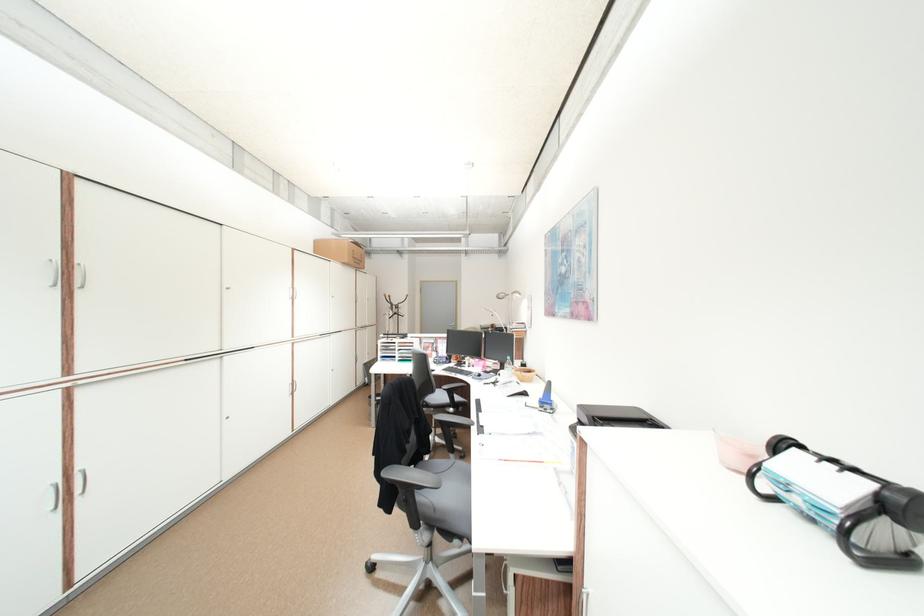
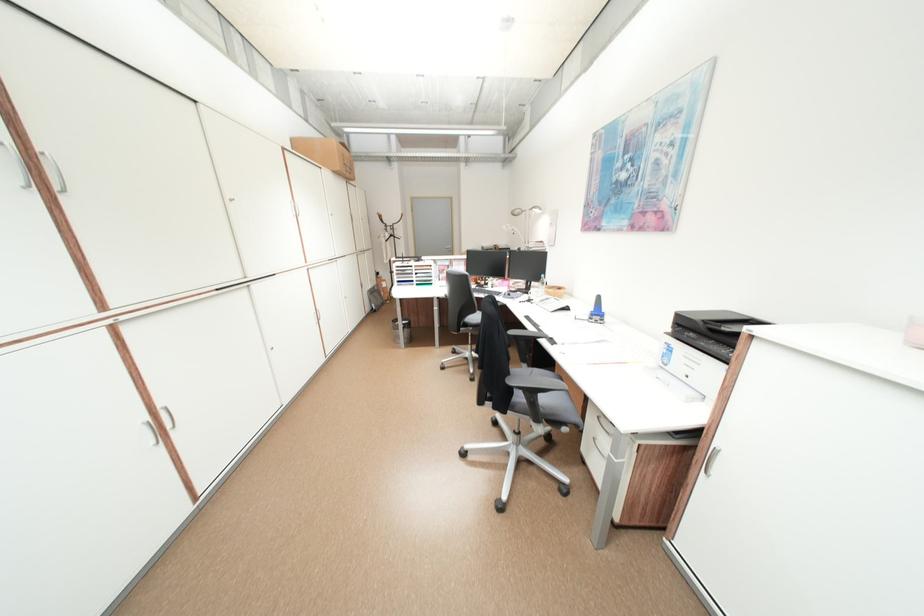
Question: Based on the continuous images, in which direction is the camera rotating? Reply with the corresponding letter.

Choices:
 (A) Left
 (B) Right
 (C) Up
 (D) Down

Answer: (D)